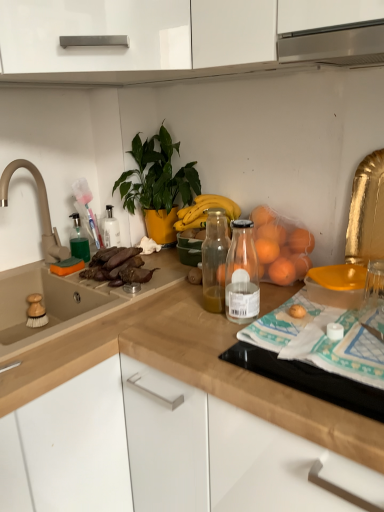
Find the location of a particular element. The height and width of the screenshot is (512, 384). vacant area that is in front of brown matte sweet potatoes at sink is located at coordinates (116, 298).